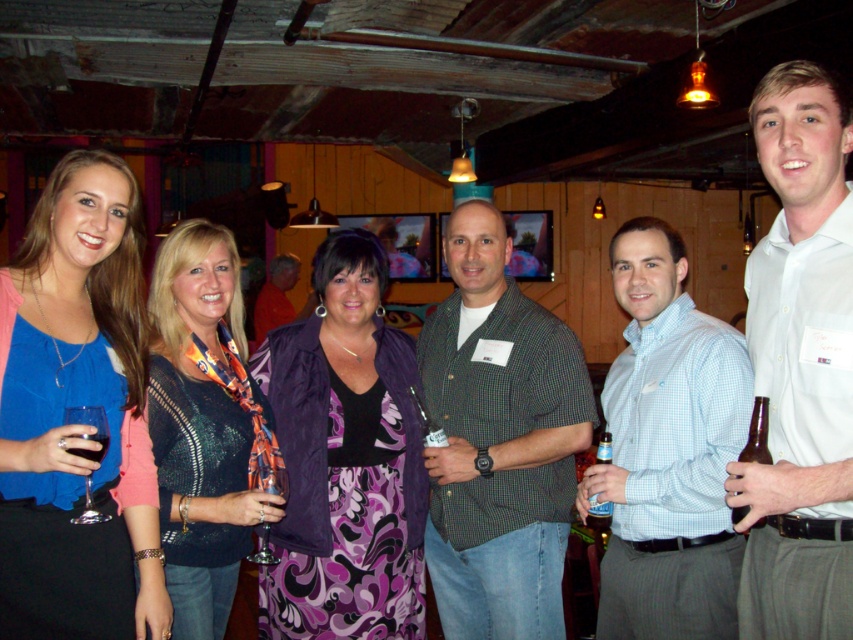
You are a photographer adjusting your camera settings to capture the group photo. You notice the matte blue blouse at center and the clear glass wine glass at center. Which object is taller when viewed from the front?

The matte blue blouse at center is taller than the clear glass wine glass at center according to the description.

You are a photographer standing at the center of the room. You want to take a photo of the orange shirt at center and the brown glass bottle at right. Can you fit both into your camera frame which has a maximum field of view of 5 meters between the closest and farthest objects? Please explain your reasoning.

The orange shirt at center and brown glass bottle at right are 6.09 meters apart, which exceeds the camera frame field of view of 5 meters. Therefore, you cannot fit both into the frame.

You are standing at the entrance of the venue and want to know if the knitted sweater at center and the orange shirt at center are close enough to shake hands. Can you determine this based on their distance?

The knitted sweater at center and the orange shirt at center are 5.08 meters apart, which is too far for them to shake hands as the typical handshake distance is about 1 meter. Therefore, they are not close enough to shake hands.